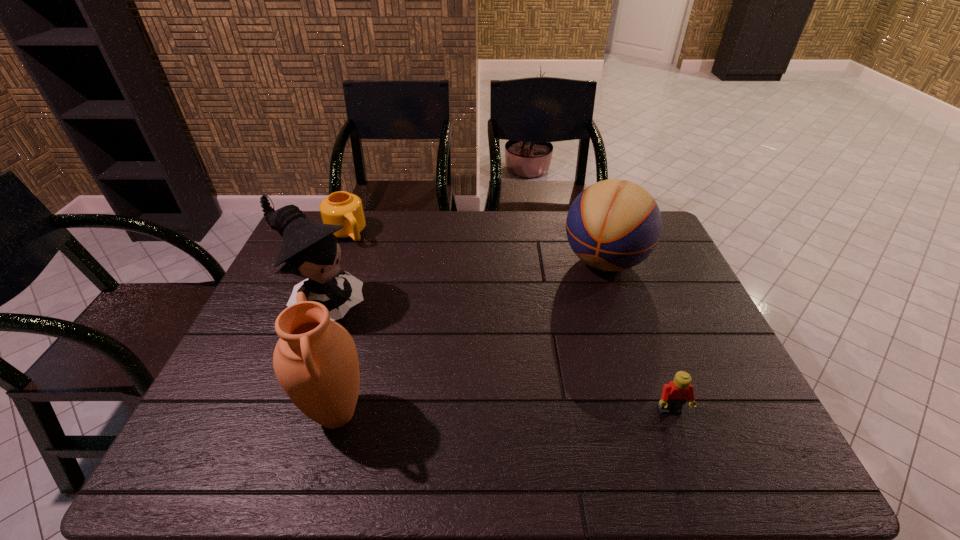
Identify the location of vacant space located 0.380m on the patterned surface of the basketball. (538, 377).

At what (x,y) coordinates should I click in order to perform the action: click on vacant region located 0.100m on the patterned surface of the basketball. Please return your answer as a coordinate pair (x, y). The width and height of the screenshot is (960, 540). Looking at the image, I should click on (578, 307).

What are the coordinates of `vacant space located 0.060m on the handle side of the mug` in the screenshot? It's located at (360, 255).

What are the coordinates of `vacant space located 0.050m on the handle side of the mug` in the screenshot? It's located at (359, 254).

At what (x,y) coordinates should I click in order to perform the action: click on blank space located 0.150m on the handle side of the mug. Please return your answer as a coordinate pair (x, y). The image size is (960, 540). Looking at the image, I should click on (372, 270).

The height and width of the screenshot is (540, 960). I want to click on basketball situated at the far edge, so click(613, 225).

The height and width of the screenshot is (540, 960). Identify the location of mug located in the far edge section of the desktop. (342, 208).

Find the location of `urn located at the near edge`. urn located at the near edge is located at coordinates (315, 360).

You are a GUI agent. You are given a task and a screenshot of the screen. Output one action in this format:
    pyautogui.click(x=<x>, y=<y>)
    Task: Click on the Lego that is at the near edge
    The height and width of the screenshot is (540, 960).
    Given the screenshot: What is the action you would take?
    pyautogui.click(x=674, y=395)

Identify the location of doll at the left edge. (310, 250).